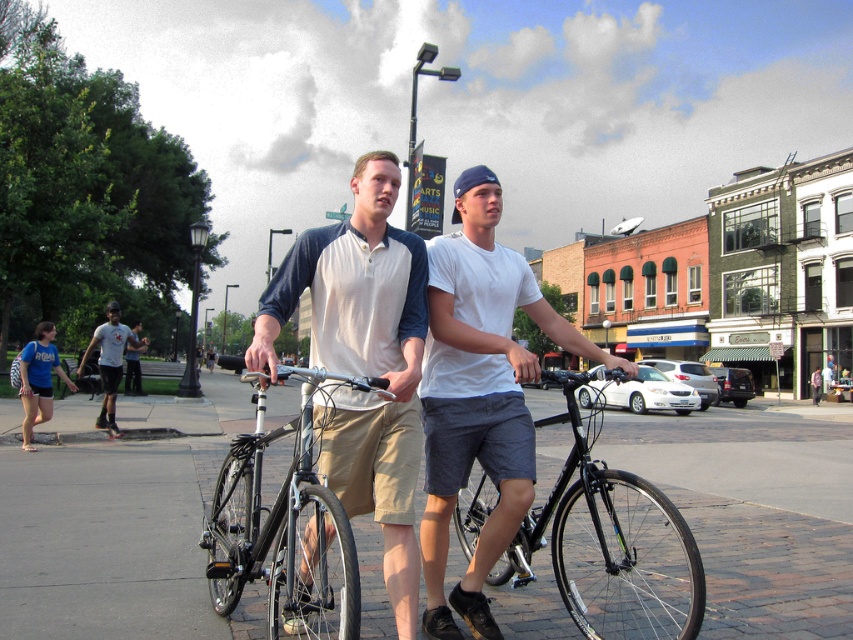
You are a photographer trying to capture a clear shot of the matte white shirt at center and the white matte bicycle at center. Since both are white, you want to ensure they are distinguishable in the photo. According to the scene description, which object is placed above the other?

The matte white shirt at center is positioned over the white matte bicycle at center, meaning the shirt is above the bicycle in the image, creating a clear visual separation between the two white objects.

You are a delivery person who needs to choose between the black matte bicycle at center and the silver metallic bicycle at center for a job that requires carrying heavy packages. Which bicycle would be more suitable based on their heights?

The black matte bicycle at center has a greater height compared to the silver metallic bicycle at center, making it more suitable for carrying heavy packages as taller bicycles often have a higher load capacity and stability.

You are standing at the camera position and want to place a 10 feet long banner on the ground. Can the brick pavement at center accommodate the banner?

The brick pavement at center is 13.86 feet away from camera, so the banner can be placed there as it is longer than the banner length.